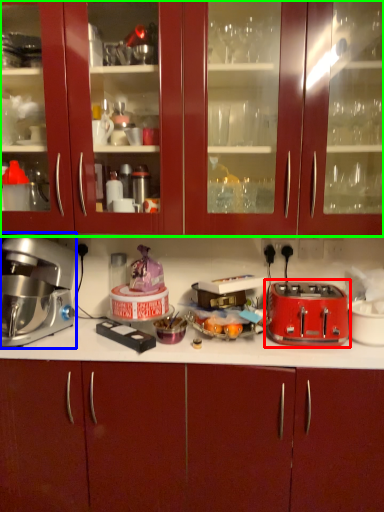
Question: Estimate the real-world distances between objects in this image. Which object is farther from toaster (highlighted by a red box), home appliance (highlighted by a blue box) or cabinetry (highlighted by a green box)?

Choices:
 (A) home appliance
 (B) cabinetry

Answer: (A)